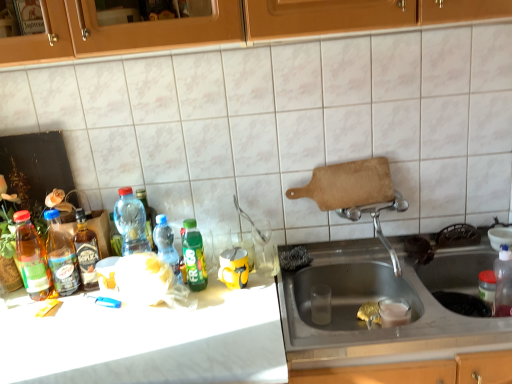
Where is `free space above white marble countertop at center (from a real-world perspective)`? free space above white marble countertop at center (from a real-world perspective) is located at coordinates (124, 322).